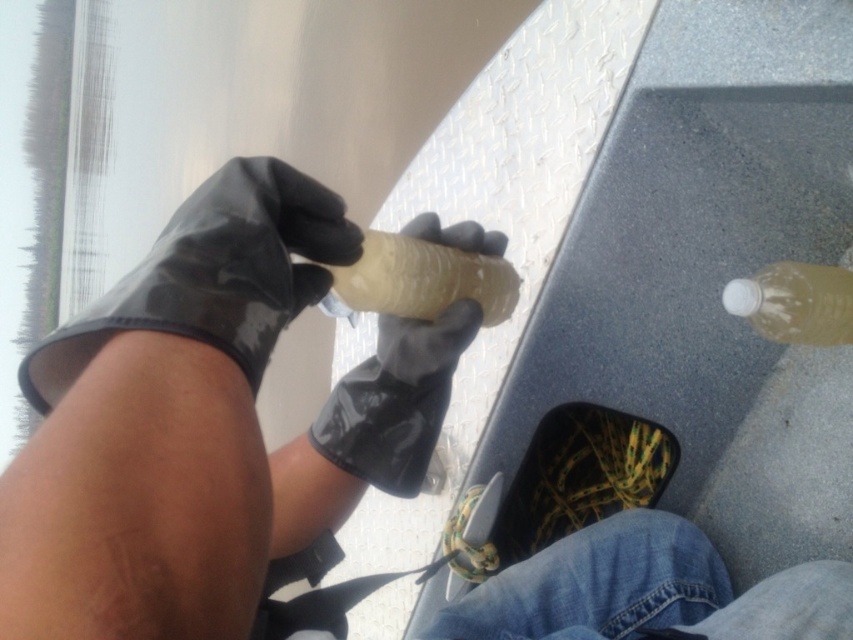
Question: Is translucent plastic bottle at lower right smaller than translucent rubber glove at center?

Choices:
 (A) no
 (B) yes

Answer: (B)

Question: Is black rubber glove at center positioned before translucent plastic bottle at center?

Choices:
 (A) yes
 (B) no

Answer: (B)

Question: Does black rubber glove at upper left appear on the right side of translucent plastic bottle at lower right?

Choices:
 (A) yes
 (B) no

Answer: (B)

Question: Among these objects, which one is farthest from the camera?

Choices:
 (A) black rubber glove at upper left
 (B) translucent rubber glove at center
 (C) translucent plastic bottle at center
 (D) translucent plastic bottle at lower right

Answer: (D)

Question: Which object is positioned farthest from the translucent plastic bottle at lower right?

Choices:
 (A) black rubber glove at center
 (B) translucent rubber glove at center

Answer: (A)

Question: Which object appears closest to the camera in this image?

Choices:
 (A) black rubber glove at center
 (B) translucent plastic bottle at lower right
 (C) translucent plastic bottle at center
 (D) translucent rubber glove at center

Answer: (C)